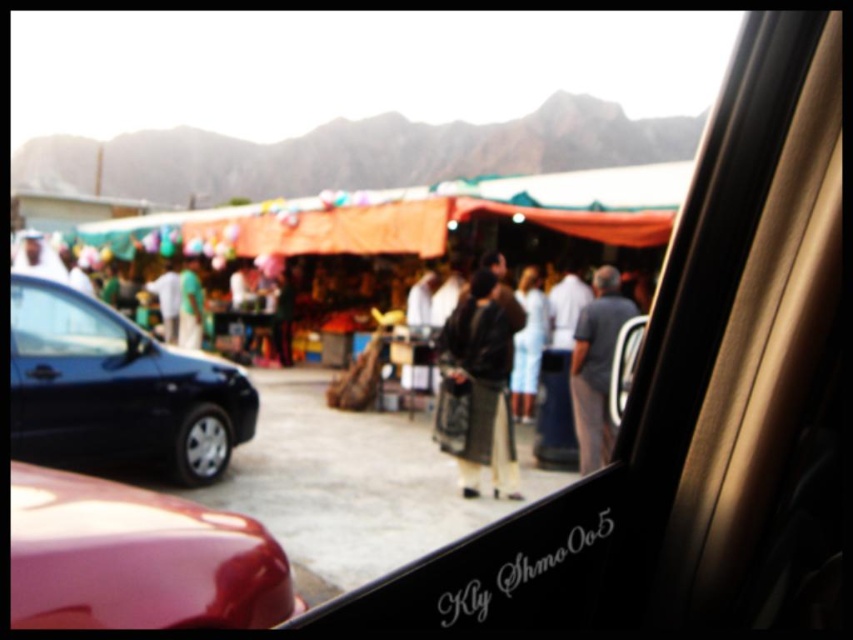
You are a passenger in the black glossy car at left and want to see the gray cotton shirt at center clearly. Since the car window is partially fogged, which object should you wipe to get a better view?

You should wipe the black glossy car at left because it is shorter than the gray cotton shirt at center, making it closer to you and obstructing your view.

You are a passenger in the car and notice two items hanging on the back of the front seat. The leather jacket at center and the gray cotton shirt at center are both visible through the window. Which one is closer to the dashboard?

The leather jacket at center is located below the gray cotton shirt at center, so it is closer to the dashboard.